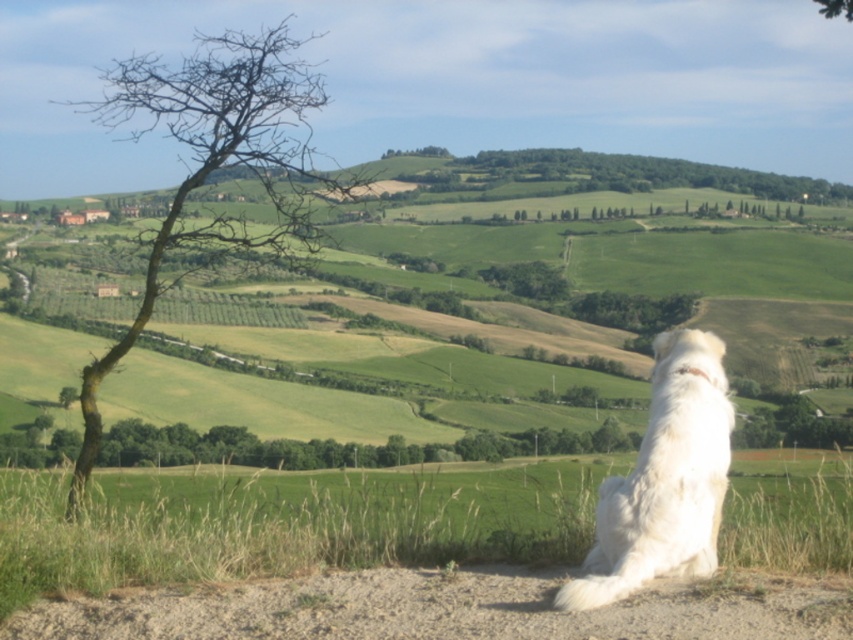
Can you confirm if green grassy hillside at center is smaller than white fluffy dog at lower right?

Yes.

Does green grassy hillside at center appear on the right side of white fluffy dog at lower right?

Correct, you'll find green grassy hillside at center to the right of white fluffy dog at lower right.

Is point (68, 326) positioned behind point (607, 512)?

That is True.

The image size is (853, 640). In order to click on green grassy hillside at center in this screenshot , I will do `click(503, 314)`.

From the picture: Is bare branches at left bigger than white fluffy dog at lower right?

Yes.

Locate an element on the screen. bare branches at left is located at coordinates [213, 163].

Is green grassy hillside at center below bare branches at left?

Yes.

Does point (105, 259) lie in front of point (314, 108)?

No, (105, 259) is further to viewer.

You are a GUI agent. You are given a task and a screenshot of the screen. Output one action in this format:
    pyautogui.click(x=<x>, y=<y>)
    Task: Click on the green grassy hillside at center
    This screenshot has width=853, height=640.
    Given the screenshot: What is the action you would take?
    click(x=503, y=314)